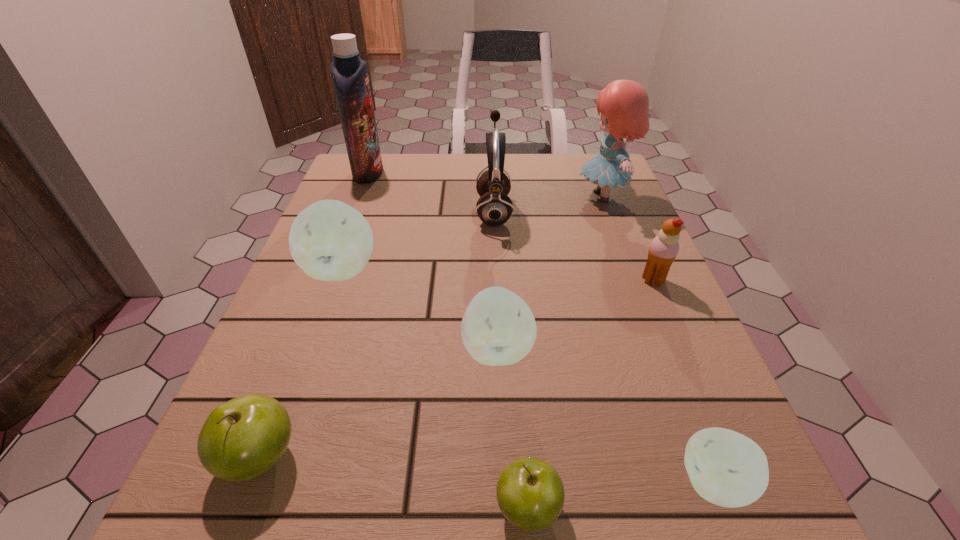
You are a GUI agent. You are given a task and a screenshot of the screen. Output one action in this format:
    pyautogui.click(x=<x>, y=<y>)
    Task: Click on the vacant space at the near edge of the desktop
    The image size is (960, 540).
    Given the screenshot: What is the action you would take?
    pyautogui.click(x=389, y=514)

Identify the location of free space at the left edge. The width and height of the screenshot is (960, 540). (349, 307).

Find the location of a particular element. vacant space at the right edge of the desktop is located at coordinates (617, 268).

Identify the location of free space at the near right corner of the desktop. (678, 532).

This screenshot has width=960, height=540. What are the coordinates of `free space between the brown earphone and the second nearest white apple` in the screenshot? It's located at pyautogui.click(x=495, y=280).

What are the coordinates of `free point between the seventh shortest object and the icecream` in the screenshot? It's located at (573, 245).

Where is `unoccupied position between the leftmost white apple and the rightmost white apple`? The height and width of the screenshot is (540, 960). unoccupied position between the leftmost white apple and the rightmost white apple is located at coordinates (528, 376).

Where is `vacant space in between the doll and the brown earphone`? The image size is (960, 540). vacant space in between the doll and the brown earphone is located at coordinates (548, 203).

You are a GUI agent. You are given a task and a screenshot of the screen. Output one action in this format:
    pyautogui.click(x=<x>, y=<y>)
    Task: Click on the blank region between the second farthest apple and the eighth shortest object
    This screenshot has height=540, width=960.
    Given the screenshot: What is the action you would take?
    pyautogui.click(x=550, y=272)

The height and width of the screenshot is (540, 960). What are the coordinates of `vacant space in between the tallest object and the left green apple` in the screenshot? It's located at (314, 315).